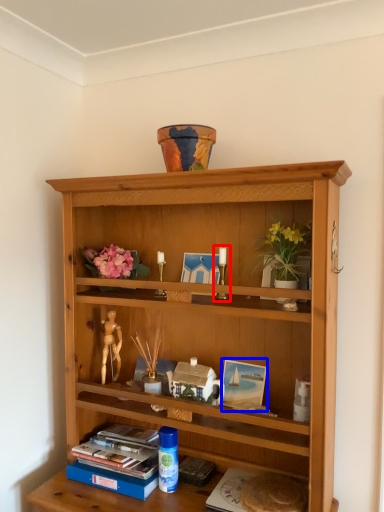
Question: Which object appears farthest to the camera in this image, candle holder (highlighted by a red box) or picture frame (highlighted by a blue box)?

Choices:
 (A) candle holder
 (B) picture frame

Answer: (B)